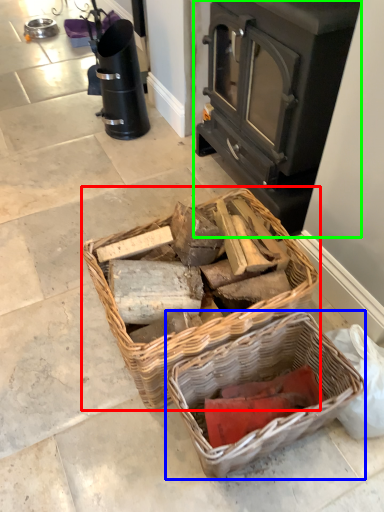
Question: Which is nearer to the picnic basket (highlighted by a red box)? picnic basket (highlighted by a blue box) or wood burning stove (highlighted by a green box).

Choices:
 (A) picnic basket
 (B) wood burning stove

Answer: (A)